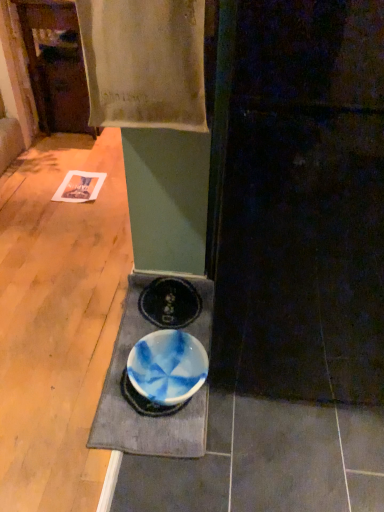
At what (x,y) coordinates should I click in order to perform the action: click on vacant space to the right of blue glazed bowl at lower center. Please return your answer as a coordinate pair (x, y). The height and width of the screenshot is (512, 384). Looking at the image, I should click on pyautogui.click(x=248, y=417).